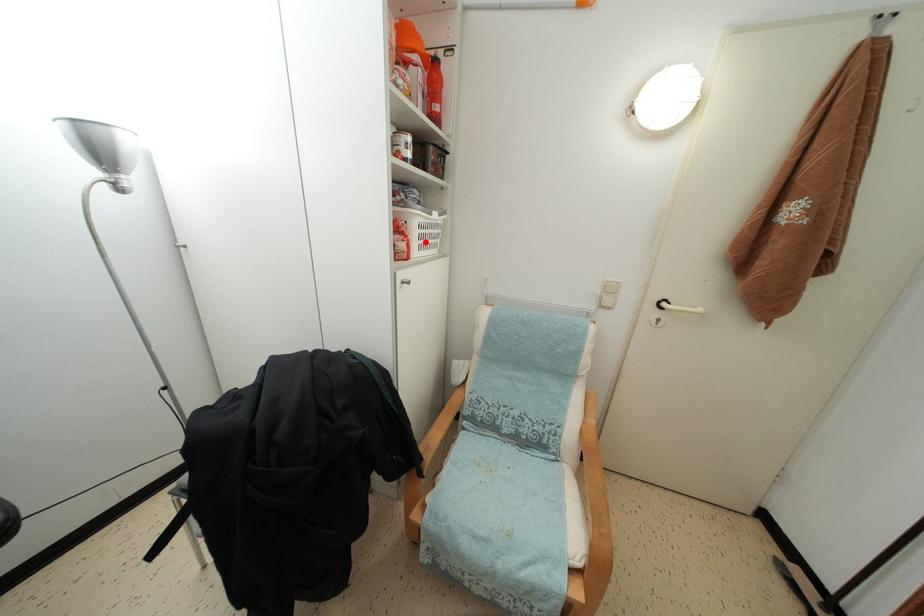
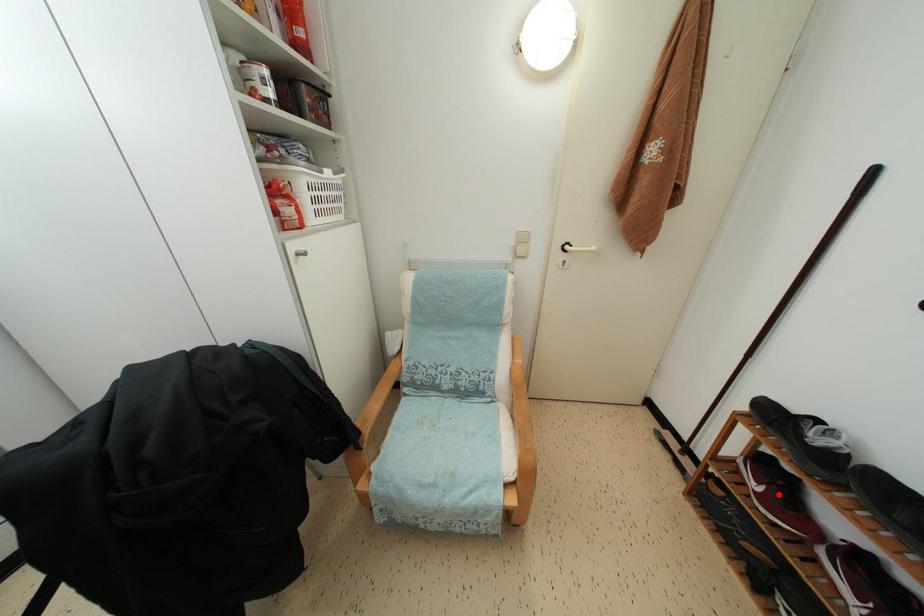
I am providing you with two images of the same scene from different viewpoints. A red point is marked on the first image and another point is marked on the second image. Is the red point in image1 aligned with the point shown in image2?

No